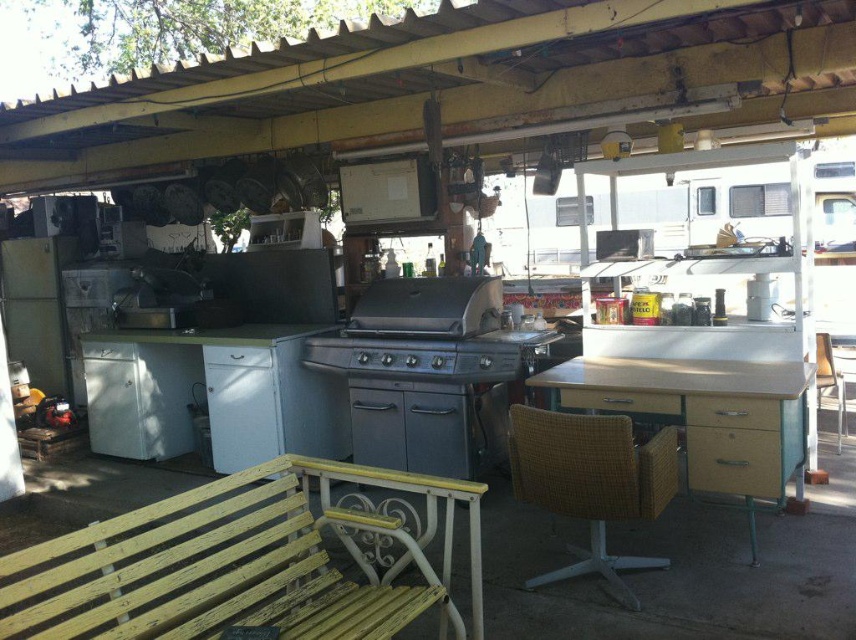
Can you confirm if yellow painted wood bench at lower left is positioned above light wood/wooden table at center?

No.

Is yellow painted wood bench at lower left shorter than light wood/wooden table at center?

Indeed, yellow painted wood bench at lower left has a lesser height compared to light wood/wooden table at center.

Does point (369, 573) come farther from viewer compared to point (759, 493)?

No.

I want to click on yellow painted wood bench at lower left, so click(223, 566).

Which is above, light wood/wooden table at center or woven wood chair at right?

light wood/wooden table at center

Which is more to the right, light wood/wooden table at center or woven wood chair at right?

woven wood chair at right is more to the right.

Describe the element at coordinates (703, 416) in the screenshot. The width and height of the screenshot is (856, 640). I see `light wood/wooden table at center` at that location.

Where is `light wood/wooden table at center`? light wood/wooden table at center is located at coordinates (703, 416).

Is yellow painted wood bench at lower left smaller than woven brown chair at center?

No, yellow painted wood bench at lower left is not smaller than woven brown chair at center.

Is point (296, 488) closer to viewer compared to point (551, 451)?

Yes, point (296, 488) is in front of point (551, 451).

This screenshot has width=856, height=640. What do you see at coordinates (223, 566) in the screenshot?
I see `yellow painted wood bench at lower left` at bounding box center [223, 566].

This screenshot has width=856, height=640. Find the location of `yellow painted wood bench at lower left`. yellow painted wood bench at lower left is located at coordinates (223, 566).